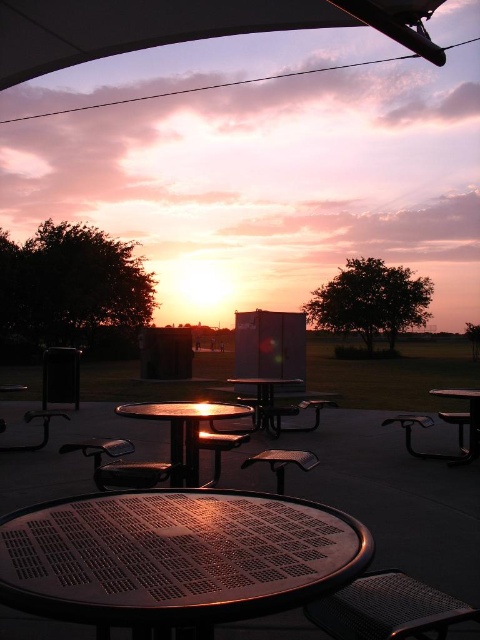
Question: Which of these objects is positioned farthest from the metallic round table at center?

Choices:
 (A) metallic brown stool at center
 (B) metallic black table at center
 (C) metallic perforated table at center

Answer: (B)

Question: Observing the image, what is the correct spatial positioning of metallic perforated table at center in reference to metallic round table at center?

Choices:
 (A) left
 (B) right

Answer: (B)

Question: In this image, where is metallic black table at center located relative to metallic silver table at lower right?

Choices:
 (A) right
 (B) left

Answer: (B)

Question: Which of the following is the closest to the observer?

Choices:
 (A) click(x=119, y=506)
 (B) click(x=296, y=461)
 (C) click(x=470, y=435)

Answer: (A)

Question: Estimate the real-world distances between objects in this image. Which object is farther from the metallic perforated table at center?

Choices:
 (A) metallic round table at center
 (B) metallic silver table at lower right

Answer: (B)

Question: Observing the image, what is the correct spatial positioning of metallic perforated table at center in reference to metallic round table at center?

Choices:
 (A) above
 (B) below

Answer: (A)